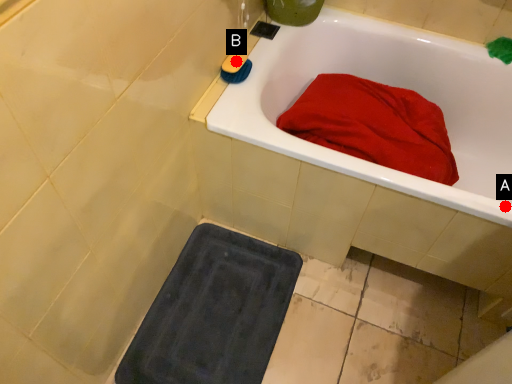
Question: Two points are circled on the image, labeled by A and B beside each circle. Which point appears closest to the camera in this image?

Choices:
 (A) A is closer
 (B) B is closer

Answer: (A)